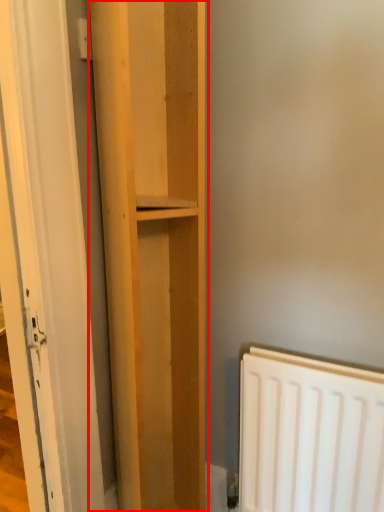
Question: Considering the relative positions of cupboard (annotated by the red box) and door in the image provided, where is cupboard (annotated by the red box) located with respect to the staircase?

Choices:
 (A) right
 (B) left

Answer: (A)